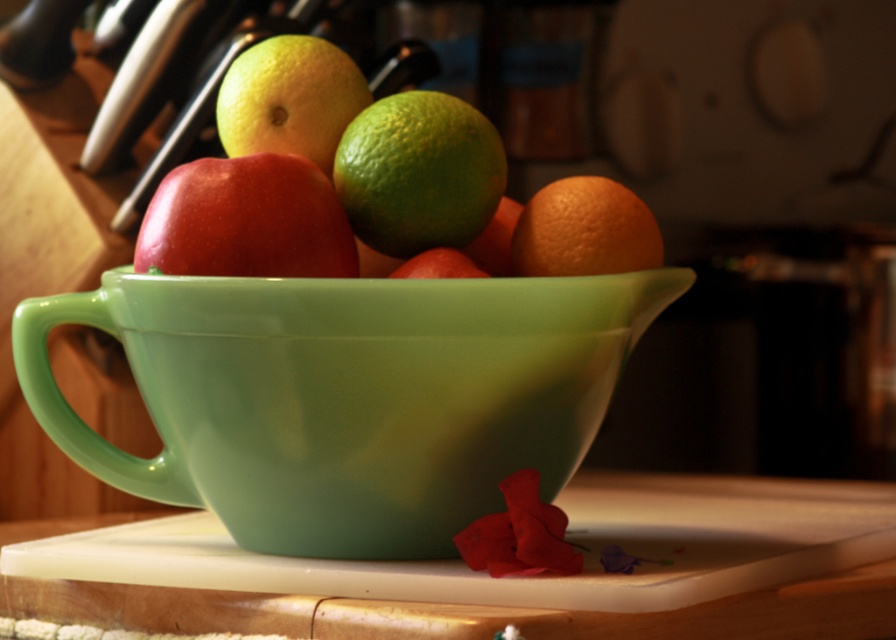
Which is behind, point (242, 232) or point (575, 262)?

Point (575, 262)

Which of these two, glossy red apple at center or orange matte at right, stands shorter?

orange matte at right is shorter.

Locate an element on the screen. This screenshot has height=640, width=896. glossy red apple at center is located at coordinates click(x=246, y=220).

Can you confirm if glossy ceramic bowl at center is positioned to the left of green matte lime at center?

Correct, you'll find glossy ceramic bowl at center to the left of green matte lime at center.

Is glossy ceramic bowl at center wider than green matte lime at center?

Yes.

What do you see at coordinates (349, 396) in the screenshot? I see `glossy ceramic bowl at center` at bounding box center [349, 396].

Locate an element on the screen. The width and height of the screenshot is (896, 640). glossy ceramic bowl at center is located at coordinates (349, 396).

Is glossy ceramic bowl at center behind white plastic cutting board at lower center?

Yes, glossy ceramic bowl at center is behind white plastic cutting board at lower center.

Is point (156, 394) behind point (602, 620)?

Yes, point (156, 394) is farther from viewer.

This screenshot has height=640, width=896. Find the location of `glossy ceramic bowl at center`. glossy ceramic bowl at center is located at coordinates (349, 396).